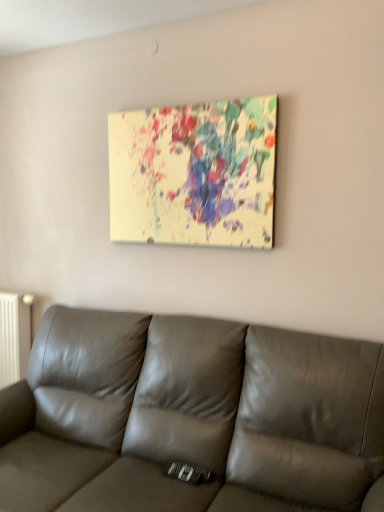
Question: From the image's perspective, is white matte radiator at left over leather couch at center?

Choices:
 (A) no
 (B) yes

Answer: (B)

Question: Is white matte radiator at left far away from leather couch at center?

Choices:
 (A) no
 (B) yes

Answer: (A)

Question: Is white matte radiator at left closer to the viewer compared to leather couch at center?

Choices:
 (A) yes
 (B) no

Answer: (B)

Question: Considering the relative sizes of white matte radiator at left and leather couch at center in the image provided, is white matte radiator at left taller than leather couch at center?

Choices:
 (A) yes
 (B) no

Answer: (B)

Question: From a real-world perspective, is white matte radiator at left on leather couch at center?

Choices:
 (A) yes
 (B) no

Answer: (A)

Question: Can you confirm if white matte radiator at left is wider than leather couch at center?

Choices:
 (A) yes
 (B) no

Answer: (B)

Question: Is leather couch at center touching white matte radiator at left?

Choices:
 (A) yes
 (B) no

Answer: (B)

Question: Is leather couch at center to the left of white matte radiator at left from the viewer's perspective?

Choices:
 (A) no
 (B) yes

Answer: (A)

Question: Is leather couch at center further to the viewer compared to white matte radiator at left?

Choices:
 (A) yes
 (B) no

Answer: (B)

Question: From the image's perspective, is leather couch at center beneath white matte radiator at left?

Choices:
 (A) no
 (B) yes

Answer: (B)

Question: Is leather couch at center not within white matte radiator at left?

Choices:
 (A) yes
 (B) no

Answer: (A)

Question: Does leather couch at center appear on the right side of white matte radiator at left?

Choices:
 (A) yes
 (B) no

Answer: (A)

Question: From the image's perspective, is painted canvas at upper center on white matte radiator at left?

Choices:
 (A) no
 (B) yes

Answer: (B)